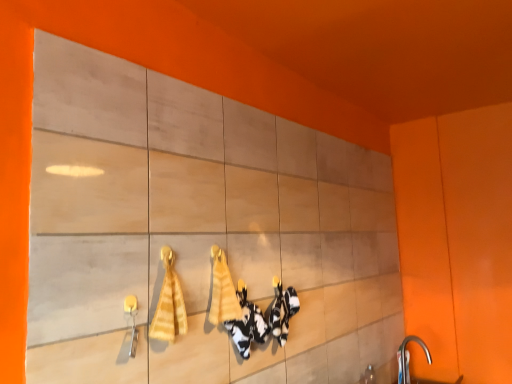
Question: Is yellow fabric bath towel at center, the 1th bath towel from the back, positioned with its back to matte wood cabinet at center?

Choices:
 (A) no
 (B) yes

Answer: (B)

Question: Can you confirm if yellow fabric bath towel at center, which appears as the second bath towel when viewed from the left, is smaller than matte wood cabinet at center?

Choices:
 (A) yes
 (B) no

Answer: (A)

Question: Does yellow fabric bath towel at center, the 1th bath towel from the back, appear on the right side of matte wood cabinet at center?

Choices:
 (A) yes
 (B) no

Answer: (B)

Question: Is yellow fabric bath towel at center, which appears as the second bath towel when viewed from the left, taller than matte wood cabinet at center?

Choices:
 (A) yes
 (B) no

Answer: (B)

Question: From a real-world perspective, is yellow fabric bath towel at center, the first bath towel from the right, on top of matte wood cabinet at center?

Choices:
 (A) no
 (B) yes

Answer: (B)

Question: Is yellow fabric bath towel at center, the second bath towel in the front-to-back sequence, not close to matte wood cabinet at center?

Choices:
 (A) yes
 (B) no

Answer: (B)

Question: From a real-world perspective, is yellow striped towel at center, arranged as the 2th bath towel when viewed from the right, located higher than silver metallic faucet at lower right?

Choices:
 (A) yes
 (B) no

Answer: (A)

Question: From the image's perspective, is yellow striped towel at center, arranged as the 2th bath towel when viewed from the right, on top of silver metallic faucet at lower right?

Choices:
 (A) yes
 (B) no

Answer: (A)

Question: Can you confirm if yellow striped towel at center, which ranks as the first bath towel in front-to-back order, is bigger than silver metallic faucet at lower right?

Choices:
 (A) yes
 (B) no

Answer: (B)

Question: Can you see yellow striped towel at center, arranged as the 1th bath towel when viewed from the left, touching silver metallic faucet at lower right?

Choices:
 (A) yes
 (B) no

Answer: (B)

Question: Is yellow striped towel at center, which ranks as the first bath towel in front-to-back order, facing towards silver metallic faucet at lower right?

Choices:
 (A) no
 (B) yes

Answer: (A)

Question: Considering the relative positions of yellow striped towel at center, which is counted as the second bath towel, starting from the back, and silver metallic faucet at lower right in the image provided, is yellow striped towel at center, which is counted as the second bath towel, starting from the back, to the left of silver metallic faucet at lower right from the viewer's perspective?

Choices:
 (A) no
 (B) yes

Answer: (B)

Question: From a real-world perspective, is yellow striped towel at center, arranged as the 2th bath towel when viewed from the right, beneath yellow fabric bath towel at center, the 1th bath towel from the back?

Choices:
 (A) no
 (B) yes

Answer: (A)